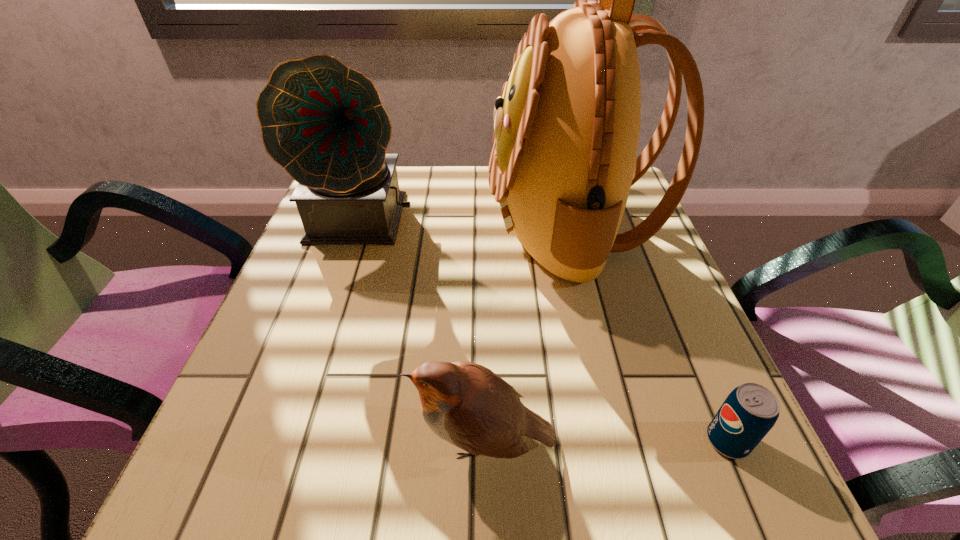
I want to click on empty location between the second shortest object and the record player, so click(x=423, y=330).

Image resolution: width=960 pixels, height=540 pixels. I want to click on vacant area that lies between the tallest object and the pop, so click(649, 333).

Identify the location of vacant area that lies between the bird and the record player. This screenshot has height=540, width=960. coord(423,330).

The width and height of the screenshot is (960, 540). Identify the location of vacant area between the second shortest object and the shortest object. (606, 441).

At what (x,y) coordinates should I click in order to perform the action: click on vacant space in between the second shortest object and the leftmost object. Please return your answer as a coordinate pair (x, y). Image resolution: width=960 pixels, height=540 pixels. Looking at the image, I should click on (423, 330).

I want to click on free space between the record player and the backpack, so click(467, 223).

You are a GUI agent. You are given a task and a screenshot of the screen. Output one action in this format:
    pyautogui.click(x=<x>, y=<y>)
    Task: Click on the empty location between the backpack and the second tallest object
    
    Given the screenshot: What is the action you would take?
    pyautogui.click(x=467, y=223)

At what (x,y) coordinates should I click in order to perform the action: click on vacant space in between the third tallest object and the backpack. Please return your answer as a coordinate pair (x, y). The height and width of the screenshot is (540, 960). Looking at the image, I should click on pos(527,333).

Locate which object ranks in proximity to the pop. Please provide its 2D coordinates. Your answer should be formatted as a tuple, i.e. [(x, y)], where the tuple contains the x and y coordinates of a point satisfying the conditions above.

[(466, 404)]

Where is `the third closest object to the second tallest object`? The image size is (960, 540). the third closest object to the second tallest object is located at coordinates (749, 412).